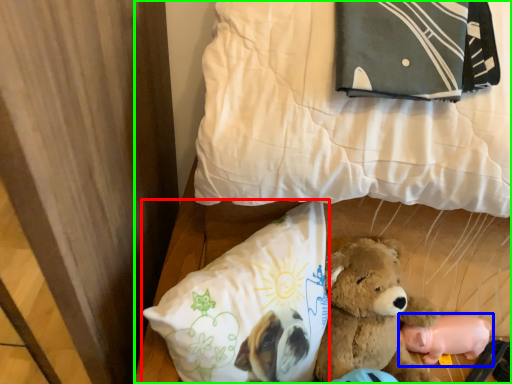
Question: Considering the real-world distances, which object is closest to pillow (highlighted by a red box)? toy (highlighted by a blue box) or bed (highlighted by a green box).

Choices:
 (A) toy
 (B) bed

Answer: (B)